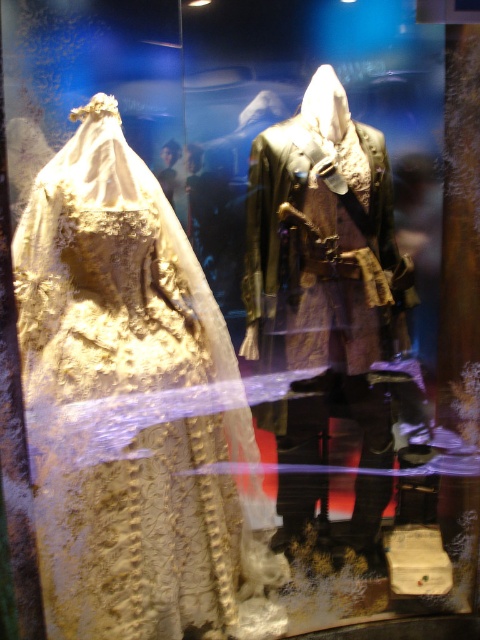
Question: Which point is closer to the camera?

Choices:
 (A) shiny brown leather coat at center
 (B) white lace dress at left

Answer: (B)

Question: Is the position of white lace dress at left less distant than that of shiny brown leather coat at center?

Choices:
 (A) yes
 (B) no

Answer: (A)

Question: Which object appears closest to the camera in this image?

Choices:
 (A) shiny brown leather coat at center
 (B) white lace dress at left

Answer: (B)

Question: Is white lace dress at left thinner than shiny brown leather coat at center?

Choices:
 (A) no
 (B) yes

Answer: (A)

Question: Is white lace dress at left above shiny brown leather coat at center?

Choices:
 (A) no
 (B) yes

Answer: (A)